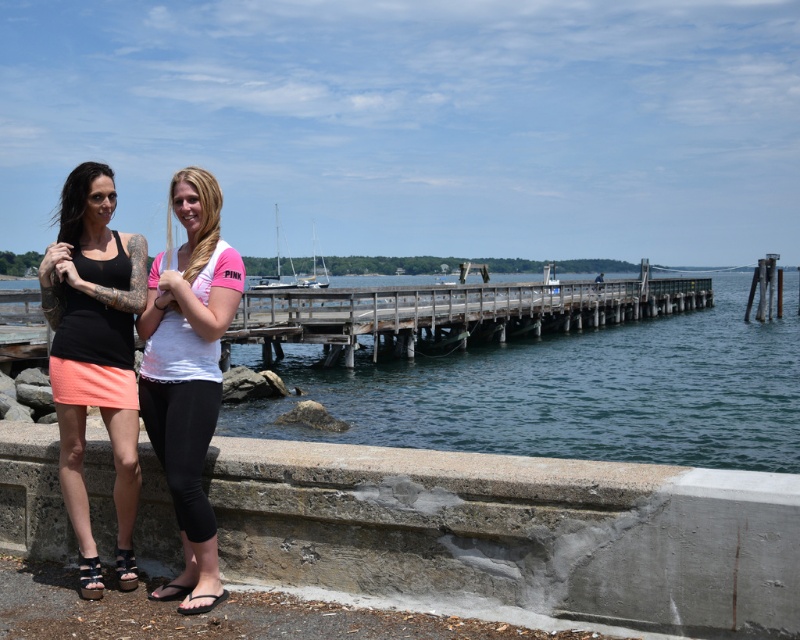
What do you see at coordinates (516, 532) in the screenshot?
I see `concrete ledge at lower center` at bounding box center [516, 532].

Can you confirm if concrete ledge at lower center is smaller than matte black tank top at left?

Yes, concrete ledge at lower center is smaller than matte black tank top at left.

The width and height of the screenshot is (800, 640). Describe the element at coordinates (516, 532) in the screenshot. I see `concrete ledge at lower center` at that location.

This screenshot has width=800, height=640. In order to click on concrete ledge at lower center in this screenshot , I will do `click(516, 532)`.

Is the position of concrete ledge at lower center less distant than that of white matte t-shirt at center?

Yes, concrete ledge at lower center is closer to the viewer.

Can you confirm if concrete ledge at lower center is shorter than white matte t-shirt at center?

Yes, concrete ledge at lower center is shorter than white matte t-shirt at center.

Is point (662, 556) behind point (198, 557)?

No, (662, 556) is closer to viewer.

Locate an element on the screen. The width and height of the screenshot is (800, 640). concrete ledge at lower center is located at coordinates (516, 532).

Is concrete ledge at lower center to the right of clear blue water at center from the viewer's perspective?

No, concrete ledge at lower center is not to the right of clear blue water at center.

Is point (488, 465) positioned before point (638, 385)?

Yes, point (488, 465) is closer to viewer.

Where is `concrete ledge at lower center`? The height and width of the screenshot is (640, 800). concrete ledge at lower center is located at coordinates (516, 532).